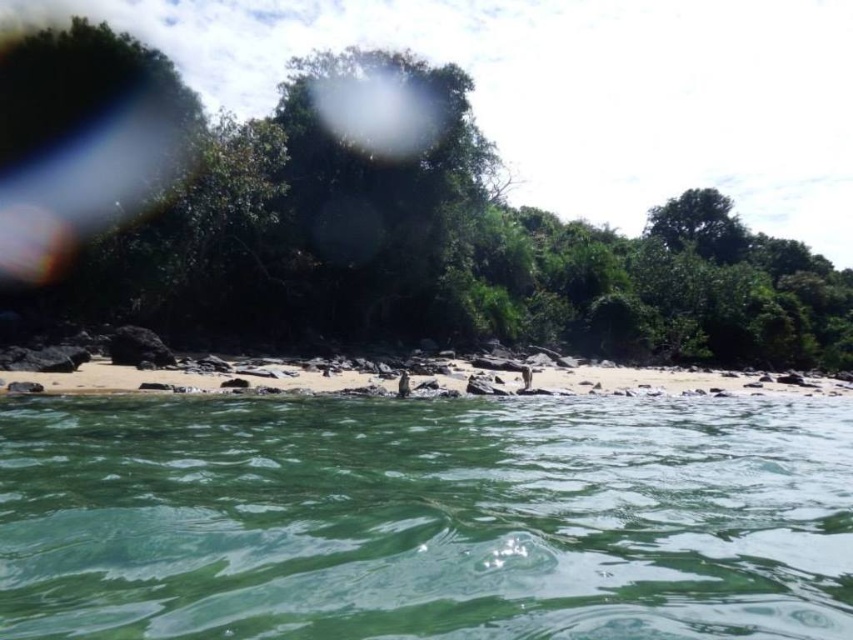
You are standing on the white sand beach at center and want to take a photo of the green leafy tree at center. Which object will occupy more space in your camera viewfinder?

The green leafy tree at center will occupy more space in your camera viewfinder because it is bigger than the white sand beach at center.

You are a swimmer trying to reach the white sand beach at center from the green translucent water at center. Based on the scene description, which direction should you swim to get to the beach?

The green translucent water at center is shorter than the white sand beach at center, so you should swim towards the direction where the white sand beach at center is located to reach it.

You are standing on the white sand beach at center and want to walk towards the green leafy tree at center. Which direction should you head?

The green leafy tree at center is to the right of the white sand beach at center, so you should head to the right to reach it.